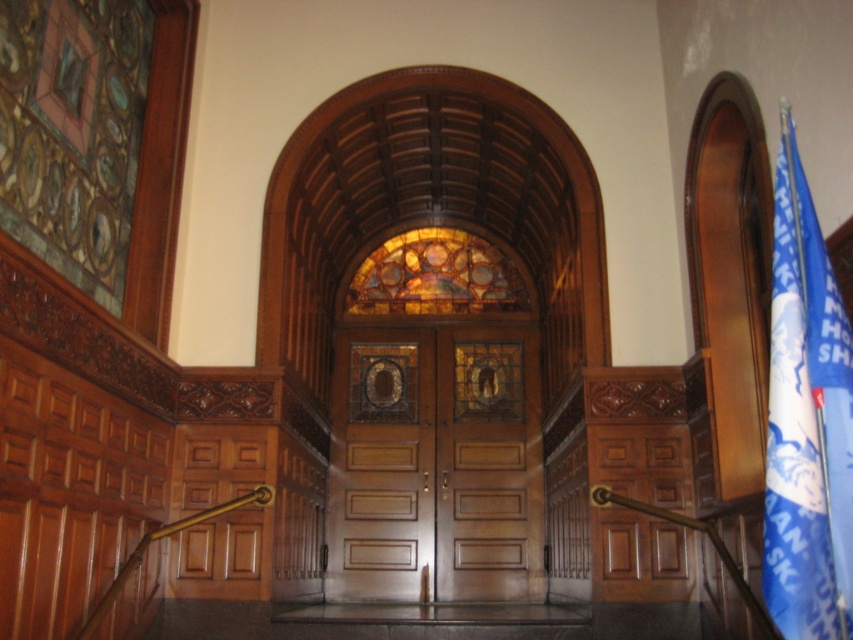
Question: Which point is closer to the camera taking this photo?

Choices:
 (A) (850, 394)
 (B) (346, 444)
 (C) (456, 250)

Answer: (A)

Question: Which point is farther from the camera taking this photo?

Choices:
 (A) (363, 312)
 (B) (834, 628)
 (C) (346, 458)

Answer: (A)

Question: Is blue fabric flag at right to the left of stained glass window at center from the viewer's perspective?

Choices:
 (A) no
 (B) yes

Answer: (A)

Question: Where is blue fabric flag at right located in relation to stained glass window at center in the image?

Choices:
 (A) left
 (B) right

Answer: (B)

Question: Does wooden door at center have a lesser width compared to blue fabric flag at right?

Choices:
 (A) no
 (B) yes

Answer: (A)

Question: Based on their relative distances, which object is farther from the stained glass window at center?

Choices:
 (A) wooden door at center
 (B) blue fabric flag at right

Answer: (B)